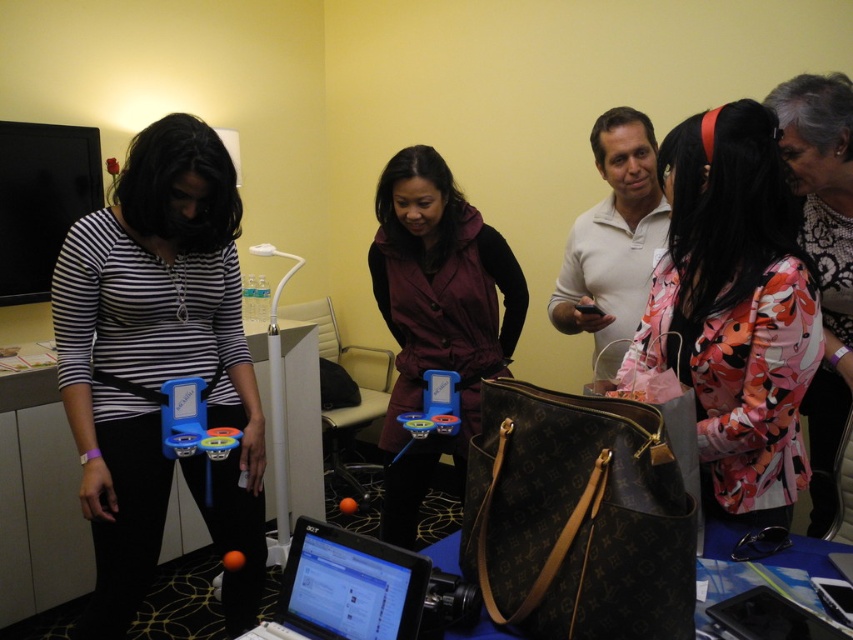
Which is more to the left, floral fabric blouse at center or black plastic laptop at lower right?

black plastic laptop at lower right is more to the left.

Who is more distant from viewer, (833, 465) or (792, 618)?

The point (833, 465) is behind.

Does point (782, 106) come in front of point (809, 621)?

No, it is behind (809, 621).

Locate an element on the screen. The height and width of the screenshot is (640, 853). floral fabric blouse at center is located at coordinates (822, 257).

Does matte black shirt at center have a greater width compared to floral fabric jacket at center?

Yes, matte black shirt at center is wider than floral fabric jacket at center.

Is matte black shirt at center taller than floral fabric jacket at center?

Yes.

This screenshot has width=853, height=640. What do you see at coordinates (160, 365) in the screenshot?
I see `matte black shirt at center` at bounding box center [160, 365].

The width and height of the screenshot is (853, 640). Find the location of `matte black shirt at center`. matte black shirt at center is located at coordinates (160, 365).

Is black glossy laptop at center positioned in front of brown leather bag at lower center?

Yes, it is.

Looking at this image, who is shorter, black glossy laptop at center or brown leather bag at lower center?

brown leather bag at lower center is shorter.

At what (x,y) coordinates should I click in order to perform the action: click on black glossy laptop at center. Please return your answer as a coordinate pair (x, y). The height and width of the screenshot is (640, 853). Looking at the image, I should click on (345, 588).